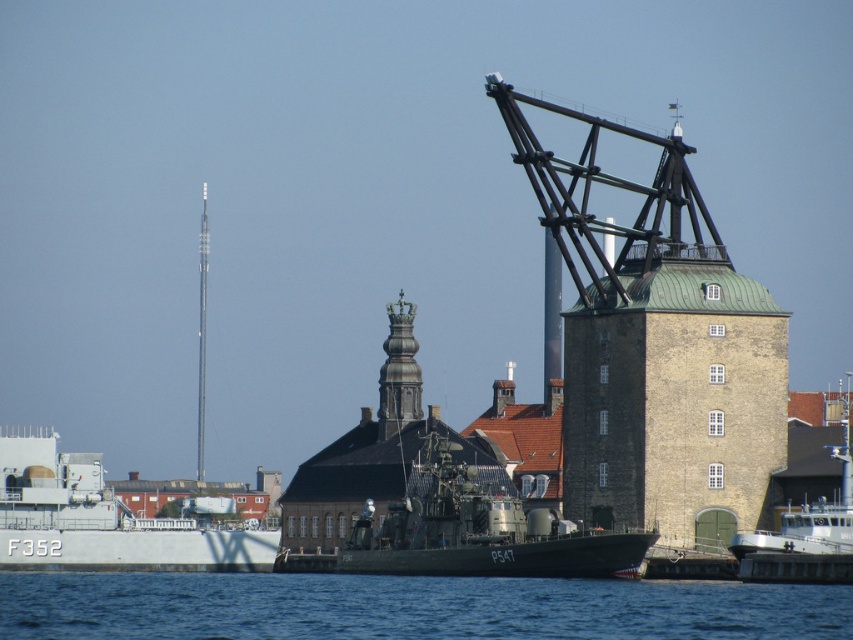
Question: Among these points, which one is farthest from the camera?

Choices:
 (A) (192, 588)
 (B) (418, 557)
 (C) (737, 408)

Answer: (A)

Question: Estimate the real-world distances between objects in this image. Which object is closer to the blue water at lower center?

Choices:
 (A) brown stone tower at center
 (B) white matte boat at center
 (C) green matte military boat at center
 (D) white matte ship at left

Answer: (C)

Question: Which of these objects is positioned farthest from the white matte boat at center?

Choices:
 (A) brown stone tower at center
 (B) blue water at lower center
 (C) green matte military boat at center
 (D) white matte ship at left

Answer: (D)

Question: Is blue water at lower center wider than green matte military boat at center?

Choices:
 (A) no
 (B) yes

Answer: (B)

Question: Can you confirm if green matte military boat at center is wider than white matte ship at left?

Choices:
 (A) yes
 (B) no

Answer: (B)

Question: Does brown stone tower at center come behind blue water at lower center?

Choices:
 (A) yes
 (B) no

Answer: (A)